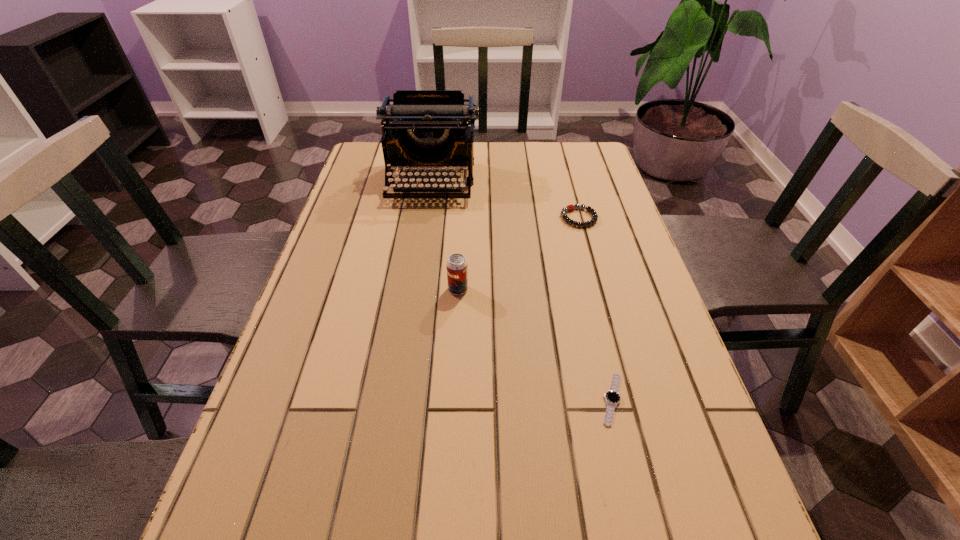
Identify the location of the third closest object relative to the shortest object. Image resolution: width=960 pixels, height=540 pixels. (422, 128).

This screenshot has width=960, height=540. What are the coordinates of `object identified as the closest to the watch` in the screenshot? It's located at (457, 275).

Where is `free spot that satisfies the following two spatial constraints: 1. on the front side of the nearest object; 2. on the left side of the third farthest object`? free spot that satisfies the following two spatial constraints: 1. on the front side of the nearest object; 2. on the left side of the third farthest object is located at coordinates (452, 399).

Locate an element on the screen. The width and height of the screenshot is (960, 540). free space that satisfies the following two spatial constraints: 1. on the typing side of the beer can; 2. on the right side of the farthest object is located at coordinates (416, 289).

Find the location of a particular element. Image resolution: width=960 pixels, height=540 pixels. vacant position in the image that satisfies the following two spatial constraints: 1. on the typing side of the second shortest object; 2. on the right side of the farthest object is located at coordinates (426, 218).

I want to click on vacant space that satisfies the following two spatial constraints: 1. on the front side of the second tallest object; 2. on the right side of the watch, so click(x=452, y=399).

This screenshot has height=540, width=960. What are the coordinates of `vacant space that satisfies the following two spatial constraints: 1. on the back side of the shortest object; 2. on the right side of the bracelet` in the screenshot? It's located at (568, 218).

Locate an element on the screen. Image resolution: width=960 pixels, height=540 pixels. vacant space that satisfies the following two spatial constraints: 1. on the typing side of the watch; 2. on the left side of the farthest object is located at coordinates (399, 399).